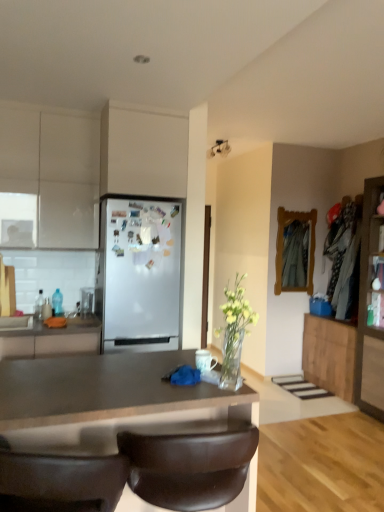
What is the approximate height of wooden cabinet at right, acting as the 4th cabinetry starting from the left?

wooden cabinet at right, acting as the 4th cabinetry starting from the left, is 30.06 inches in height.

Identify the location of matte brown countertop at center. Image resolution: width=384 pixels, height=512 pixels. (106, 390).

The image size is (384, 512). What are the coordinates of `matte white countertop at left, which is the 2th cabinetry from left to right` in the screenshot? It's located at (52, 338).

What are the coordinates of `matte white cabinet at upper center, acting as the 3th cabinetry starting from the right` in the screenshot? It's located at (143, 151).

Locate an element on the screen. cabinetry that is the 1st one when counting downward from the white matte cabinet at upper left, the 5th cabinetry when ordered from right to left (from the image's perspective) is located at coordinates (371, 305).

Consider the image. Which of these two, white matte cabinet at upper left, marked as the first cabinetry in a left-to-right arrangement, or wooden cabinet at right, the fifth cabinetry positioned from the left, is smaller?

white matte cabinet at upper left, marked as the first cabinetry in a left-to-right arrangement, is smaller.

From a real-world perspective, is white matte cabinet at upper left, marked as the first cabinetry in a left-to-right arrangement, above or below wooden cabinet at right, the fifth cabinetry positioned from the left?

white matte cabinet at upper left, marked as the first cabinetry in a left-to-right arrangement, is above wooden cabinet at right, the fifth cabinetry positioned from the left.

Is wooden cabinet at right, positioned as the 1th cabinetry in right-to-left order, at the back of white matte cabinet at upper left, the 5th cabinetry when ordered from right to left?

white matte cabinet at upper left, the 5th cabinetry when ordered from right to left, is not turned away from wooden cabinet at right, positioned as the 1th cabinetry in right-to-left order.

In the scene shown: From the image's perspective, is white matte refrigerator at center below matte white countertop at left, which is the 4th cabinetry in right-to-left order?

No, from the image's perspective, white matte refrigerator at center is not beneath matte white countertop at left, which is the 4th cabinetry in right-to-left order.

Could matte white countertop at left, which is the 4th cabinetry in right-to-left order, be considered to be inside white matte refrigerator at center?

Definitely not — matte white countertop at left, which is the 4th cabinetry in right-to-left order, is not inside white matte refrigerator at center.

Between white matte refrigerator at center and matte white countertop at left, which is the 2th cabinetry from left to right, which one has more height?

With more height is white matte refrigerator at center.

Could you measure the distance between white matte refrigerator at center and matte white countertop at left, which is the 2th cabinetry from left to right?

They are 20.94 inches apart.

From the image's perspective, is wooden cabinet at right, acting as the 4th cabinetry starting from the left, over matte white countertop at left, which is the 2th cabinetry from left to right?

No, from the image's perspective, wooden cabinet at right, acting as the 4th cabinetry starting from the left, is not over matte white countertop at left, which is the 2th cabinetry from left to right.

From the picture: Who is taller, wooden cabinet at right, which is the 2th cabinetry from right to left, or matte white countertop at left, which is the 2th cabinetry from left to right?

wooden cabinet at right, which is the 2th cabinetry from right to left.

Is wooden cabinet at right, which is the 2th cabinetry from right to left, facing towards matte white countertop at left, which is the 4th cabinetry in right-to-left order?

Yes, wooden cabinet at right, which is the 2th cabinetry from right to left, faces towards matte white countertop at left, which is the 4th cabinetry in right-to-left order.

Does wooden cabinet at right, which is the 2th cabinetry from right to left, have a greater width compared to matte white countertop at left, which is the 4th cabinetry in right-to-left order?

Incorrect, the width of wooden cabinet at right, which is the 2th cabinetry from right to left, does not surpass that of matte white countertop at left, which is the 4th cabinetry in right-to-left order.

Can you confirm if brown leather chair at lower center is taller than matte white countertop at left, which is the 2th cabinetry from left to right?

Yes, brown leather chair at lower center is taller than matte white countertop at left, which is the 2th cabinetry from left to right.

Is brown leather chair at lower center not close to matte white countertop at left, which is the 4th cabinetry in right-to-left order?

brown leather chair at lower center is positioned a significant distance from matte white countertop at left, which is the 4th cabinetry in right-to-left order.

Does brown leather chair at lower center appear on the left side of matte white countertop at left, which is the 4th cabinetry in right-to-left order?

No.

Considering the positions of objects white matte refrigerator at center and matte white cabinet at upper center, acting as the 3th cabinetry starting from the right, in the image provided, who is behind, white matte refrigerator at center or matte white cabinet at upper center, acting as the 3th cabinetry starting from the right,?

Positioned behind is white matte refrigerator at center.

Does white matte refrigerator at center have a greater height compared to matte white cabinet at upper center, acting as the 3th cabinetry starting from the right?

Yes.

Does white matte refrigerator at center appear on the right side of matte white cabinet at upper center, acting as the 3th cabinetry starting from the right?

Incorrect, white matte refrigerator at center is not on the right side of matte white cabinet at upper center, acting as the 3th cabinetry starting from the right.

Considering the relative sizes of white matte refrigerator at center and matte white cabinet at upper center, acting as the 3th cabinetry starting from the right, in the image provided, is white matte refrigerator at center bigger than matte white cabinet at upper center, acting as the 3th cabinetry starting from the right,?

Indeed, white matte refrigerator at center has a larger size compared to matte white cabinet at upper center, acting as the 3th cabinetry starting from the right.

Considering the positions of points (93, 349) and (199, 478), is point (93, 349) farther from camera compared to point (199, 478)?

Yes.

How different are the orientations of matte white countertop at left, which is the 2th cabinetry from left to right, and brown leather chair at lower center in degrees?

The facing directions of matte white countertop at left, which is the 2th cabinetry from left to right, and brown leather chair at lower center are 180 degrees apart.

The width and height of the screenshot is (384, 512). In the image, there is a matte white countertop at left, which is the 4th cabinetry in right-to-left order. In order to click on chair below it (from a real-world perspective) in this screenshot , I will do `click(189, 467)`.

Looking at their sizes, would you say matte white countertop at left, which is the 4th cabinetry in right-to-left order, is wider or thinner than brown leather chair at lower center?

Clearly, matte white countertop at left, which is the 4th cabinetry in right-to-left order, has more width compared to brown leather chair at lower center.

Is wooden cabinet at right, the fifth cabinetry positioned from the left, looking in the opposite direction of matte brown countertop at center?

No, wooden cabinet at right, the fifth cabinetry positioned from the left, is not facing the opposite direction of matte brown countertop at center.

Considering the points (383, 389) and (12, 378), which point is behind, point (383, 389) or point (12, 378)?

The point (383, 389) is farther from the camera.

Considering the relative positions of wooden cabinet at right, positioned as the 1th cabinetry in right-to-left order, and matte brown countertop at center in the image provided, is wooden cabinet at right, positioned as the 1th cabinetry in right-to-left order, to the left of matte brown countertop at center from the viewer's perspective?

No.

From a real-world perspective, who is located lower, wooden cabinet at right, the fifth cabinetry positioned from the left, or matte brown countertop at center?

In real-world perspective, matte brown countertop at center is lower.

Identify the location of cabinetry that is the 1st object located above the wooden cabinet at right, the fifth cabinetry positioned from the left (from the image's perspective). The width and height of the screenshot is (384, 512). (49, 176).

This screenshot has height=512, width=384. I want to click on refrigerator behind the matte white countertop at left, which is the 4th cabinetry in right-to-left order, so click(x=139, y=273).

In the scene shown: When comparing their distances from white matte cabinet at upper left, marked as the first cabinetry in a left-to-right arrangement, does wooden cabinet at right, acting as the 4th cabinetry starting from the left, or white matte refrigerator at center seem closer?

Among the two, white matte refrigerator at center is located nearer to white matte cabinet at upper left, marked as the first cabinetry in a left-to-right arrangement.

When comparing their distances from brown leather chair at lower center, does matte white countertop at left, which is the 4th cabinetry in right-to-left order, or matte brown countertop at center seem closer?

matte brown countertop at center is positioned closer to the anchor brown leather chair at lower center.

From the image, which object appears to be nearer to brown leather chair at lower center, wooden cabinet at right, the fifth cabinetry positioned from the left, or matte white cabinet at upper center, arranged as the third cabinetry when viewed from the left?

matte white cabinet at upper center, arranged as the third cabinetry when viewed from the left.

Based on their spatial positions, is matte brown countertop at center or white matte refrigerator at center closer to wooden cabinet at right, positioned as the 1th cabinetry in right-to-left order?

white matte refrigerator at center.

Considering their positions, is matte brown countertop at center positioned closer to matte white cabinet at upper center, acting as the 3th cabinetry starting from the right, than brown leather chair at lower center?

Among the two, matte brown countertop at center is located nearer to matte white cabinet at upper center, acting as the 3th cabinetry starting from the right.

Which object lies nearer to the anchor point white matte cabinet at upper left, the 5th cabinetry when ordered from right to left, matte white countertop at left, which is the 4th cabinetry in right-to-left order, or wooden cabinet at right, the fifth cabinetry positioned from the left?

matte white countertop at left, which is the 4th cabinetry in right-to-left order, lies closer to white matte cabinet at upper left, the 5th cabinetry when ordered from right to left, than the other object.

When comparing their distances from matte white cabinet at upper center, arranged as the third cabinetry when viewed from the left, does matte white countertop at left, which is the 4th cabinetry in right-to-left order, or wooden cabinet at right, acting as the 4th cabinetry starting from the left, seem closer?

Based on the image, matte white countertop at left, which is the 4th cabinetry in right-to-left order, appears to be nearer to matte white cabinet at upper center, arranged as the third cabinetry when viewed from the left.

Looking at this image, from the image, which object appears to be nearer to white matte refrigerator at center, brown leather chair at lower center or white matte cabinet at upper left, marked as the first cabinetry in a left-to-right arrangement?

Among the two, white matte cabinet at upper left, marked as the first cabinetry in a left-to-right arrangement, is located nearer to white matte refrigerator at center.

The width and height of the screenshot is (384, 512). Identify the location of cabinetry between matte white cabinet at upper center, acting as the 3th cabinetry starting from the right, and white matte refrigerator at center, in the vertical direction. (49, 176).

At what (x,y) coordinates should I click in order to perform the action: click on refrigerator between matte white countertop at left, which is the 4th cabinetry in right-to-left order, and wooden cabinet at right, which is the 2th cabinetry from right to left. Please return your answer as a coordinate pair (x, y). The height and width of the screenshot is (512, 384). Looking at the image, I should click on (139, 273).

Image resolution: width=384 pixels, height=512 pixels. Identify the location of countertop between white matte cabinet at upper left, the 5th cabinetry when ordered from right to left, and wooden cabinet at right, acting as the 4th cabinetry starting from the left. (106, 390).

In order to click on refrigerator between matte white cabinet at upper center, acting as the 3th cabinetry starting from the right, and matte white countertop at left, which is the 2th cabinetry from left to right, from top to bottom in this screenshot , I will do `click(139, 273)`.